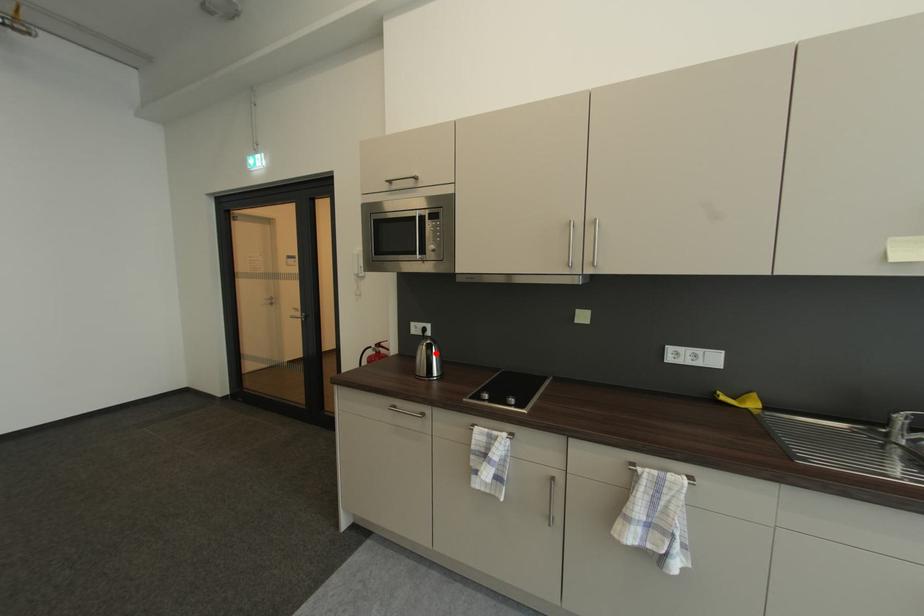
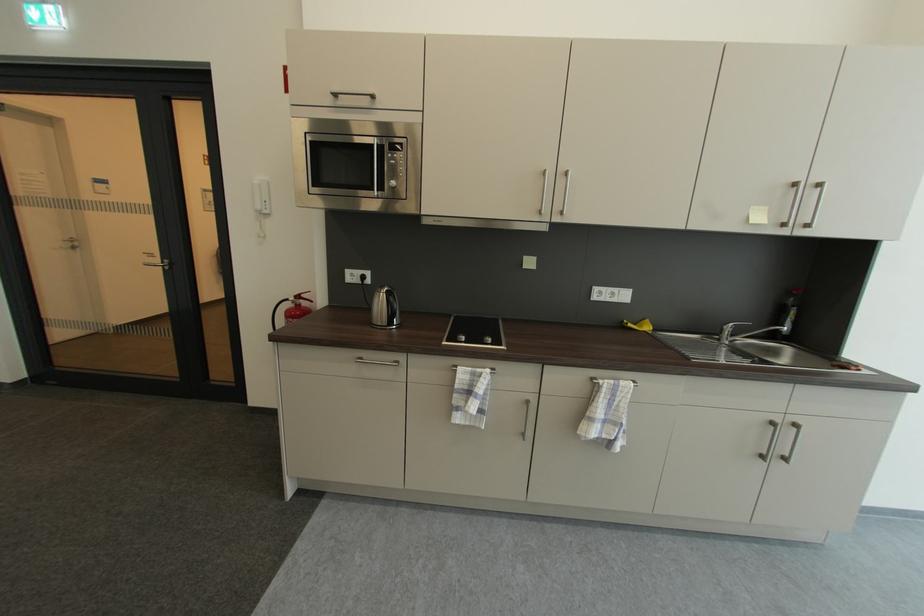
The point at the highlighted location is marked in the first image. Where is the corresponding point in the second image?

(397, 301)